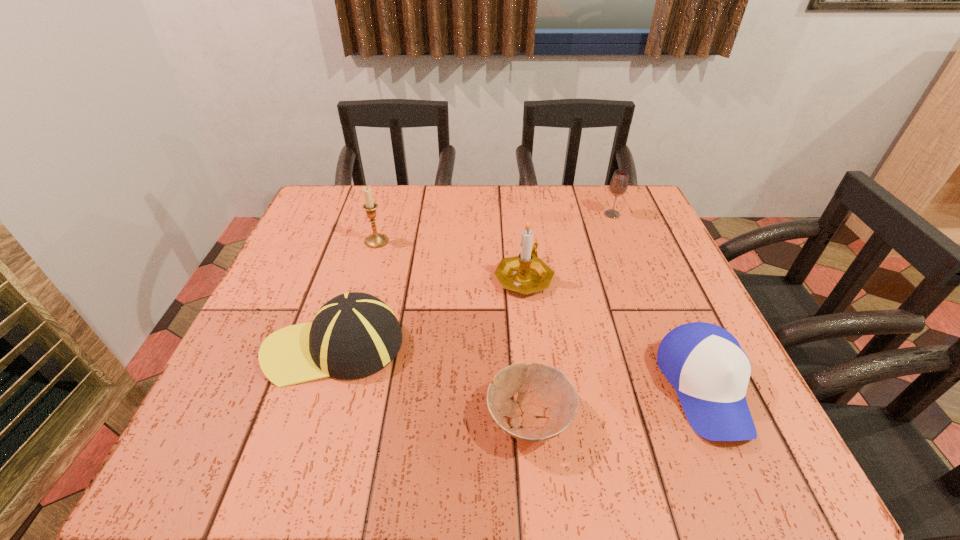
Locate an element on the screen. The image size is (960, 540). the right candle holder is located at coordinates (526, 273).

The width and height of the screenshot is (960, 540). Find the location of `the nearer candle holder`. the nearer candle holder is located at coordinates (526, 273).

You are a GUI agent. You are given a task and a screenshot of the screen. Output one action in this format:
    pyautogui.click(x=<x>, y=<y>)
    Task: Click on the farther candle holder
    
    Given the screenshot: What is the action you would take?
    pyautogui.click(x=376, y=240)

Locate an element on the screen. This screenshot has height=540, width=960. the fifth nearest object is located at coordinates (376, 240).

What are the coordinates of `the farthest object` in the screenshot? It's located at (618, 186).

The width and height of the screenshot is (960, 540). In order to click on the left baseball cap in this screenshot , I will do `click(354, 335)`.

I want to click on the shorter baseball cap, so click(x=710, y=372).

This screenshot has width=960, height=540. Find the location of `the second shortest object`. the second shortest object is located at coordinates (710, 372).

Identify the location of bowl. [549, 408].

Find the location of a particular element. free space located 0.230m on the right of the nearer candle holder is located at coordinates (656, 277).